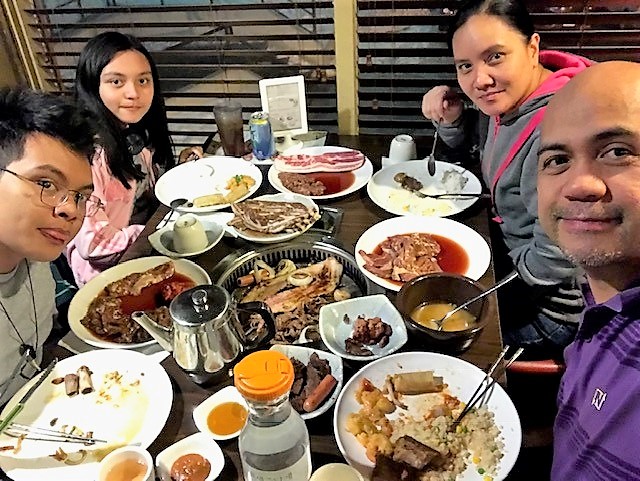
Locate an element on the screen. plates is located at coordinates (508, 407), (481, 248), (472, 179), (182, 170), (361, 177), (294, 198), (163, 389), (81, 332).